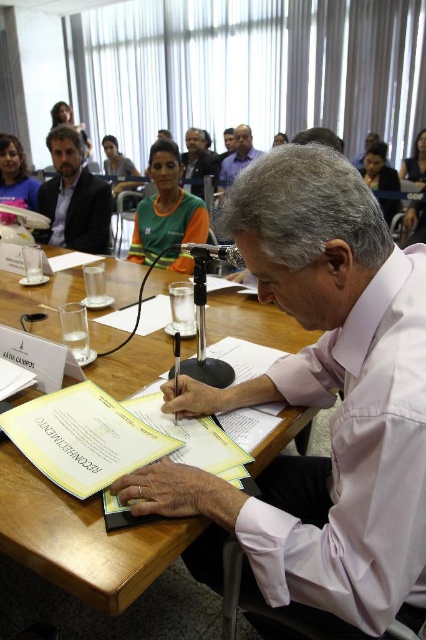
Question: Estimate the real-world distances between objects in this image. Which object is farther from the green jersey at center?

Choices:
 (A) matte black suit at left
 (B) matte blue shirt at upper center
 (C) matte black shirt at center

Answer: (B)

Question: Can you confirm if wooden table at center is positioned below green jersey at center?

Choices:
 (A) yes
 (B) no

Answer: (A)

Question: Which point is closer to the camera taking this photo?

Choices:
 (A) (173, 536)
 (B) (74, 225)

Answer: (A)

Question: Is pink fabric shirt at center thinner than matte black suit at left?

Choices:
 (A) yes
 (B) no

Answer: (A)

Question: Is wooden table at center positioned at the back of matte black shirt at center?

Choices:
 (A) yes
 (B) no

Answer: (B)

Question: Which point is farther to the camera?

Choices:
 (A) (131, 278)
 (B) (186, 138)
 (C) (104, 202)

Answer: (B)